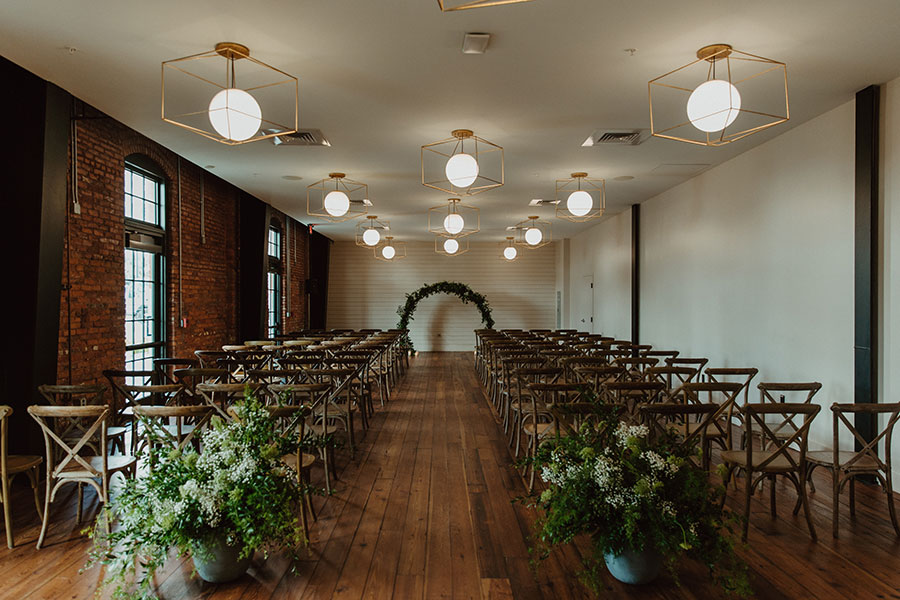
You are a GUI agent. You are given a task and a screenshot of the screen. Output one action in this format:
    pyautogui.click(x=<x>, y=<y>)
    Task: Click on the brick wall
    
    Given the screenshot: What is the action you would take?
    pyautogui.click(x=109, y=297), pyautogui.click(x=209, y=298), pyautogui.click(x=298, y=295)